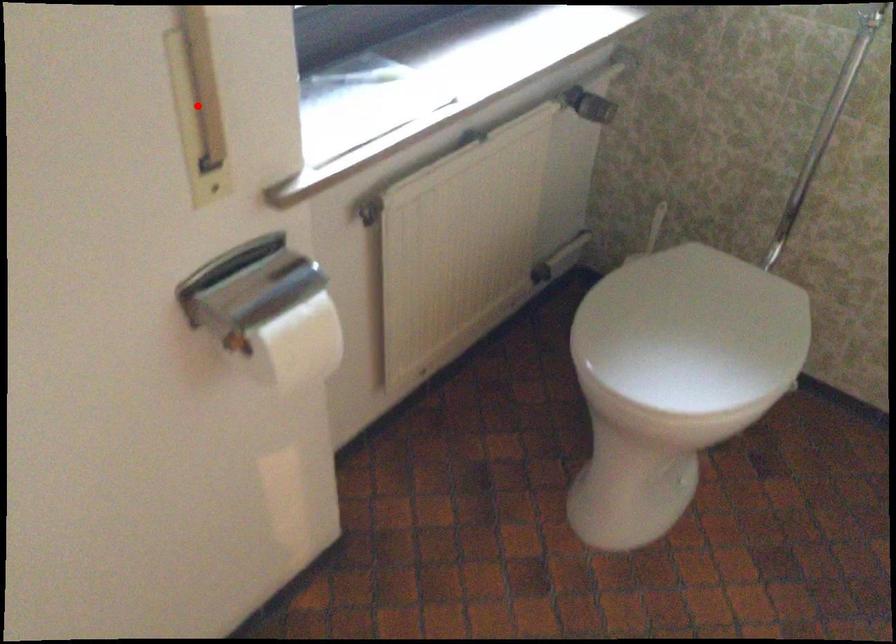
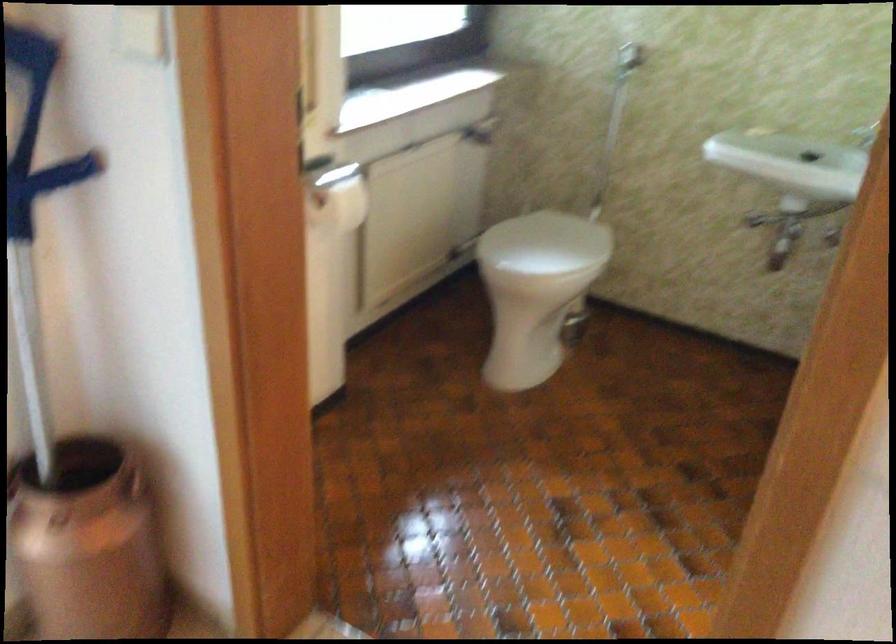
Question: I am providing you with two images of the same scene from different viewpoints. A red point is marked on the first image. Can you still see the location of the red point in image 2?

Choices:
 (A) Yes
 (B) No

Answer: (B)